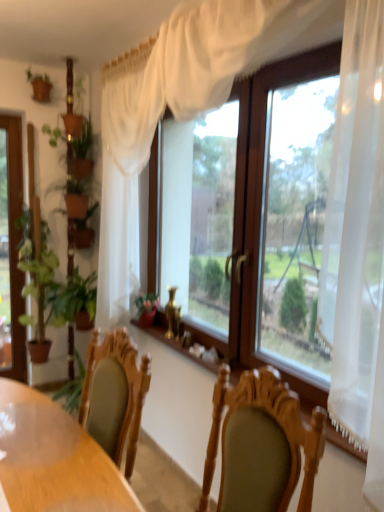
Question: Does point (180, 117) appear closer or farther from the camera than point (51, 446)?

Choices:
 (A) closer
 (B) farther

Answer: (B)

Question: From a real-world perspective, is transparent glass window at center above or below wooden table at center?

Choices:
 (A) above
 (B) below

Answer: (A)

Question: Which object is positioned farthest from the green leafy plant at left?

Choices:
 (A) transparent glass window at center
 (B) wooden table at center

Answer: (B)

Question: Estimate the real-world distances between objects in this image. Which object is closer to the wooden table at center?

Choices:
 (A) green leafy plant at left
 (B) transparent glass window at center

Answer: (B)